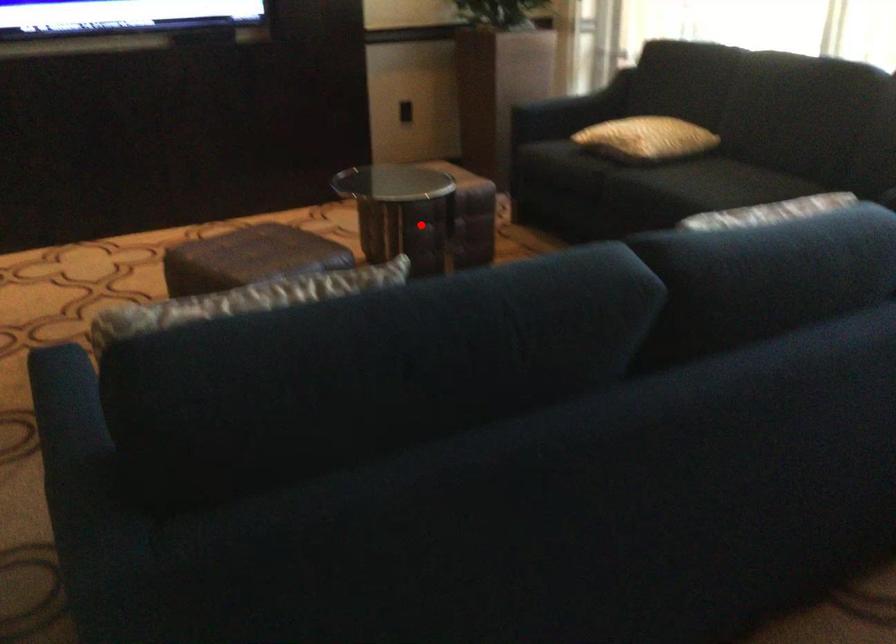
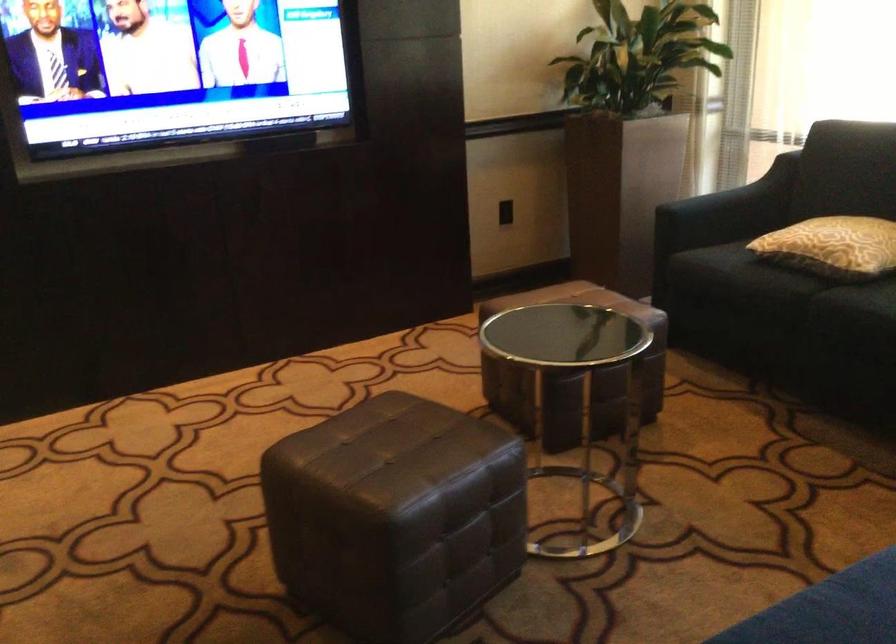
Where in the second image is the point corresponding to the highlighted location from the first image?

(573, 373)